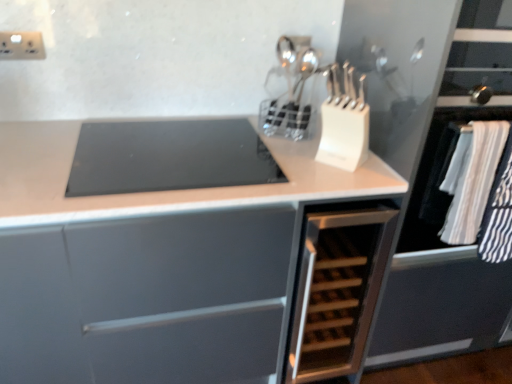
Question: From the image's perspective, is white plastic electric outlet at upper left positioned above or below matte white cabinet at center, acting as the second cabinetry starting from the right?

Choices:
 (A) below
 (B) above

Answer: (B)

Question: Considering the positions of point (18, 38) and point (167, 238), is point (18, 38) closer or farther from the camera than point (167, 238)?

Choices:
 (A) farther
 (B) closer

Answer: (A)

Question: Which is nearer to the wooden at right?

Choices:
 (A) white striped fabric at right
 (B) white plastic electric outlet at upper left
 (C) wooden rack at center, which appears as the first cabinetry when viewed from the right
 (D) white plastic knife block at upper center
 (E) black glass cooktop at center

Answer: (A)

Question: Based on their relative distances, which object is farther from the matte white cabinet at center, the first cabinetry positioned from the left?

Choices:
 (A) white striped fabric at right
 (B) black glass cooktop at center
 (C) white plastic knife block at upper center
 (D) wooden rack at center, the second cabinetry viewed from the left
 (E) wooden at right

Answer: (A)